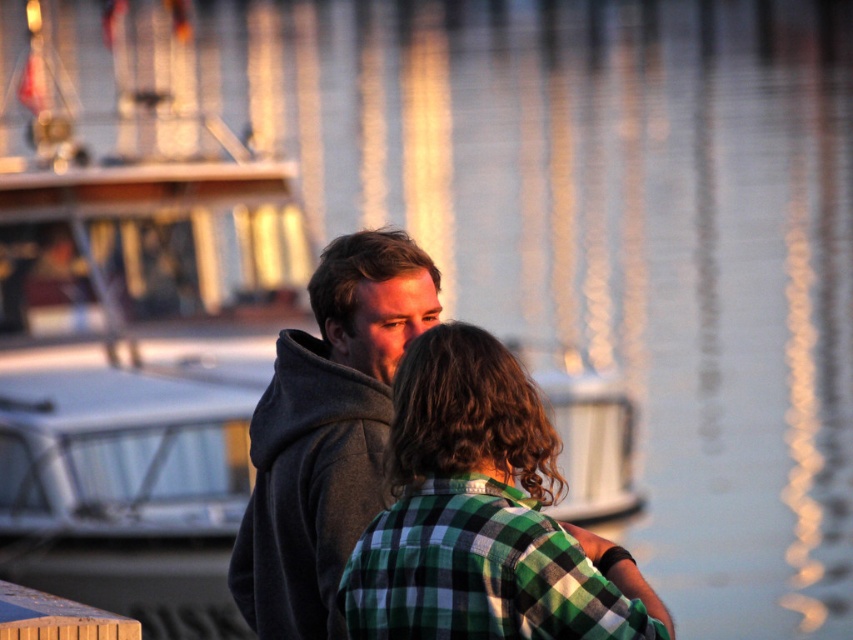
Question: Which object appears farthest from the camera in this image?

Choices:
 (A) gray hoodie at center
 (B) green plaid shirt at center

Answer: (A)

Question: Which object appears farthest from the camera in this image?

Choices:
 (A) green plaid shirt at center
 (B) gray hoodie at center

Answer: (B)

Question: Does green plaid shirt at center appear over gray hoodie at center?

Choices:
 (A) no
 (B) yes

Answer: (A)

Question: Which point is farther to the camera?

Choices:
 (A) (492, 492)
 (B) (312, 337)

Answer: (B)

Question: Is green plaid shirt at center to the left of gray hoodie at center from the viewer's perspective?

Choices:
 (A) yes
 (B) no

Answer: (B)

Question: Is green plaid shirt at center further to the viewer compared to gray hoodie at center?

Choices:
 (A) no
 (B) yes

Answer: (A)